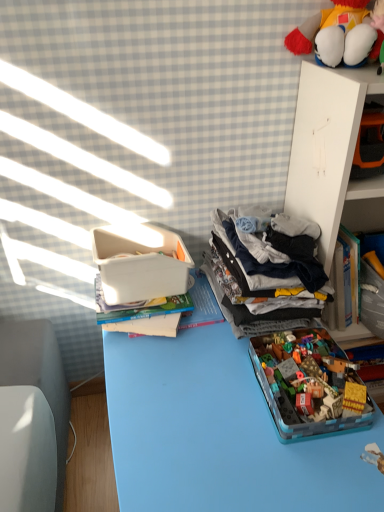
You are a GUI agent. You are given a task and a screenshot of the screen. Output one action in this format:
    pyautogui.click(x=<x>, y=<y>)
    Task: Click on the free space in front of translucent plastic container at center, the first toy ordered from the bottom
    This screenshot has width=384, height=512.
    Given the screenshot: What is the action you would take?
    pyautogui.click(x=302, y=474)